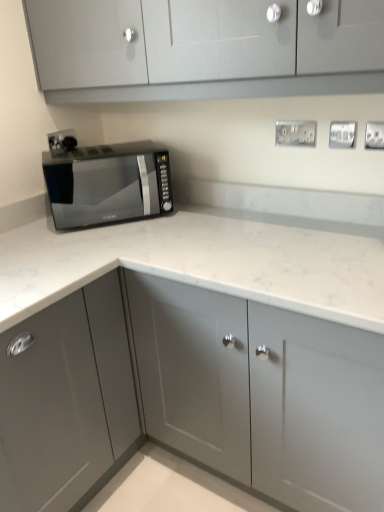
Question: Does satin silver outlet at upper right, which ranks as the fourth electric outlet in back-to-front order, have a lesser height compared to satin silver electrical outlet at upper center, the second electric outlet viewed from the back?

Choices:
 (A) no
 (B) yes

Answer: (A)

Question: Considering the relative sizes of satin silver outlet at upper right, the 1th electric outlet from the right, and satin silver electrical outlet at upper center, which is counted as the 2th electric outlet, starting from the left, in the image provided, is satin silver outlet at upper right, the 1th electric outlet from the right, wider than satin silver electrical outlet at upper center, which is counted as the 2th electric outlet, starting from the left,?

Choices:
 (A) yes
 (B) no

Answer: (B)

Question: Could you tell me if satin silver outlet at upper right, the 4th electric outlet from the left, is turned towards satin silver electrical outlet at upper center, which is the third electric outlet in right-to-left order?

Choices:
 (A) yes
 (B) no

Answer: (B)

Question: Is satin silver outlet at upper right, which ranks as the fourth electric outlet in back-to-front order, placed right next to satin silver electrical outlet at upper center, which is the third electric outlet in right-to-left order?

Choices:
 (A) no
 (B) yes

Answer: (A)

Question: Is satin silver outlet at upper right, the 4th electric outlet from the left, at the right side of satin silver electrical outlet at upper center, which is counted as the 2th electric outlet, starting from the left?

Choices:
 (A) no
 (B) yes

Answer: (B)

Question: Considering their positions, is silver metallic electric outlet at upper right, which is the 3th electric outlet from left to right, located in front of or behind matte gray cabinet at upper center, positioned as the 1th cabinetry in top-to-bottom order?

Choices:
 (A) behind
 (B) front

Answer: (A)

Question: From the image's perspective, is silver metallic electric outlet at upper right, acting as the 2th electric outlet starting from the front, above or below matte gray cabinet at upper center, the third cabinetry from the bottom?

Choices:
 (A) below
 (B) above

Answer: (A)

Question: Considering the relative positions of silver metallic electric outlet at upper right, acting as the 2th electric outlet starting from the front, and matte gray cabinet at upper center, the third cabinetry from the bottom, in the image provided, is silver metallic electric outlet at upper right, acting as the 2th electric outlet starting from the front, to the left or to the right of matte gray cabinet at upper center, the third cabinetry from the bottom,?

Choices:
 (A) left
 (B) right

Answer: (B)

Question: From a real-world perspective, is silver metallic electric outlet at upper right, which is the 2th electric outlet in right-to-left order, positioned above or below matte gray cabinet at upper center, positioned as the 1th cabinetry in top-to-bottom order?

Choices:
 (A) below
 (B) above

Answer: (A)

Question: Do you think black plastic socket at upper left, which ranks as the fourth electric outlet in front-to-back order, is within black glass microwave at left, or outside of it?

Choices:
 (A) inside
 (B) outside

Answer: (B)

Question: Is black plastic socket at upper left, placed as the 4th electric outlet when sorted from right to left, wider or thinner than black glass microwave at left?

Choices:
 (A) wide
 (B) thin

Answer: (B)

Question: Does point (66, 143) appear closer or farther from the camera than point (66, 198)?

Choices:
 (A) closer
 (B) farther

Answer: (A)

Question: In the image, is black plastic socket at upper left, the 1th electric outlet positioned from the left, positioned in front of or behind black glass microwave at left?

Choices:
 (A) behind
 (B) front

Answer: (A)

Question: Is black plastic socket at upper left, which ranks as the fourth electric outlet in front-to-back order, bigger or smaller than silver metallic electric outlet at upper right, which is the 3th electric outlet from left to right?

Choices:
 (A) small
 (B) big

Answer: (A)

Question: Is black plastic socket at upper left, which is counted as the 1th electric outlet, starting from the back, in front of or behind silver metallic electric outlet at upper right, which is the 2th electric outlet in right-to-left order, in the image?

Choices:
 (A) front
 (B) behind

Answer: (B)